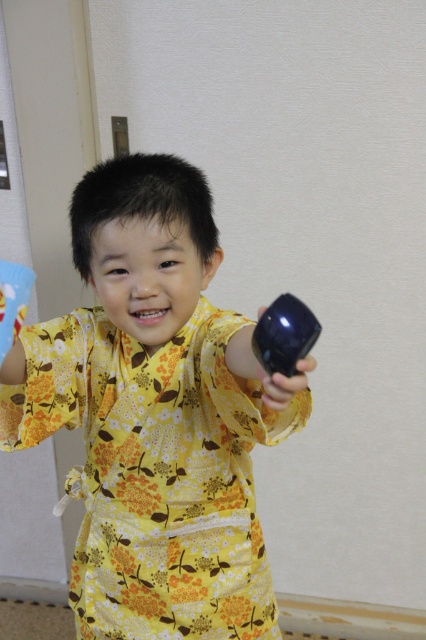
Question: Does yellow floral kimono at center have a lesser width compared to glossy plastic toy at right?

Choices:
 (A) no
 (B) yes

Answer: (A)

Question: Which of the following is the closest to the observer?

Choices:
 (A) [x=43, y=394]
 (B) [x=282, y=305]

Answer: (B)

Question: Which point is farther to the camera?

Choices:
 (A) (218, 637)
 (B) (299, 301)

Answer: (A)

Question: Which point is closer to the camera taking this photo?

Choices:
 (A) (126, 579)
 (B) (284, 358)

Answer: (B)

Question: Does yellow floral kimono at center have a smaller size compared to glossy plastic toy at right?

Choices:
 (A) no
 (B) yes

Answer: (A)

Question: Can you confirm if yellow floral kimono at center is positioned above glossy plastic toy at right?

Choices:
 (A) yes
 (B) no

Answer: (B)